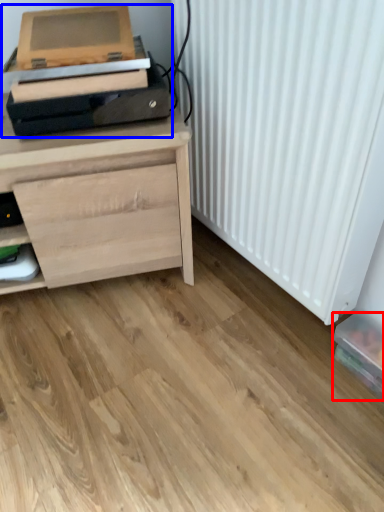
Question: Among these objects, which one is farthest to the camera, box (highlighted by a red box) or printer (highlighted by a blue box)?

Choices:
 (A) box
 (B) printer

Answer: (A)